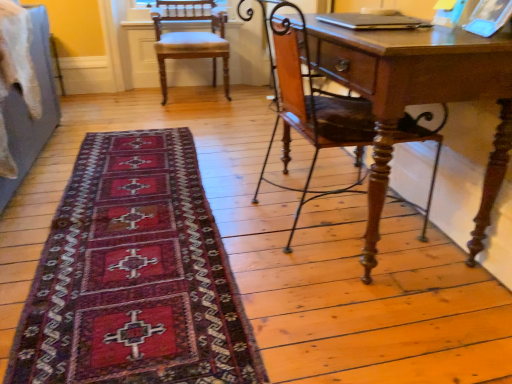
Image resolution: width=512 pixels, height=384 pixels. Find the location of `vacant area that lies between wooden chair at right, marked as the 2th chair in a left-to-right arrangement, and dark red woven rug at lower left`. vacant area that lies between wooden chair at right, marked as the 2th chair in a left-to-right arrangement, and dark red woven rug at lower left is located at coordinates (244, 191).